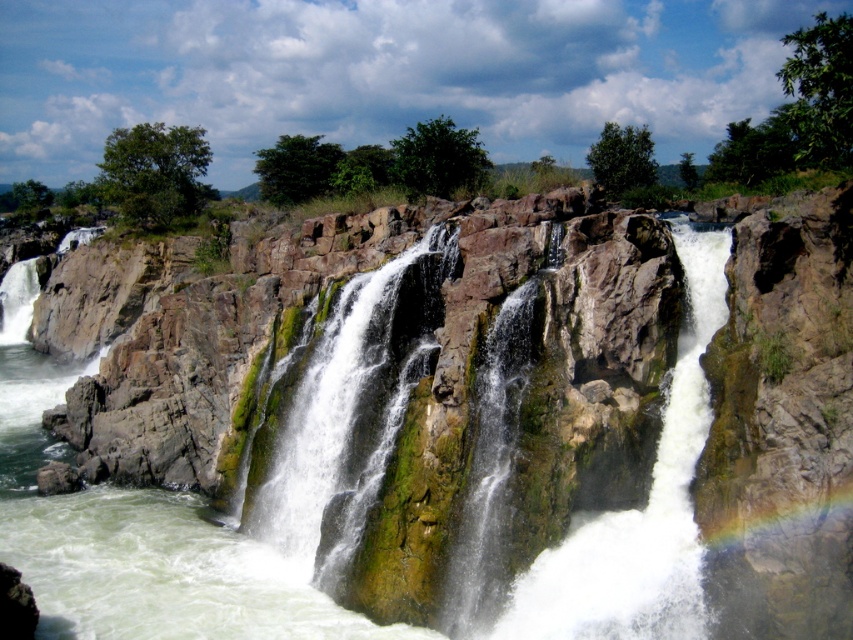
Question: Does brown rough rock at center appear over green mossy rock at center?

Choices:
 (A) yes
 (B) no

Answer: (B)

Question: Among these objects, which one is farthest from the camera?

Choices:
 (A) brown rough rock at center
 (B) green mossy rock at center

Answer: (B)

Question: Is brown rough rock at center wider than green mossy rock at center?

Choices:
 (A) no
 (B) yes

Answer: (B)

Question: Is brown rough rock at center further to the viewer compared to green mossy rock at center?

Choices:
 (A) no
 (B) yes

Answer: (A)